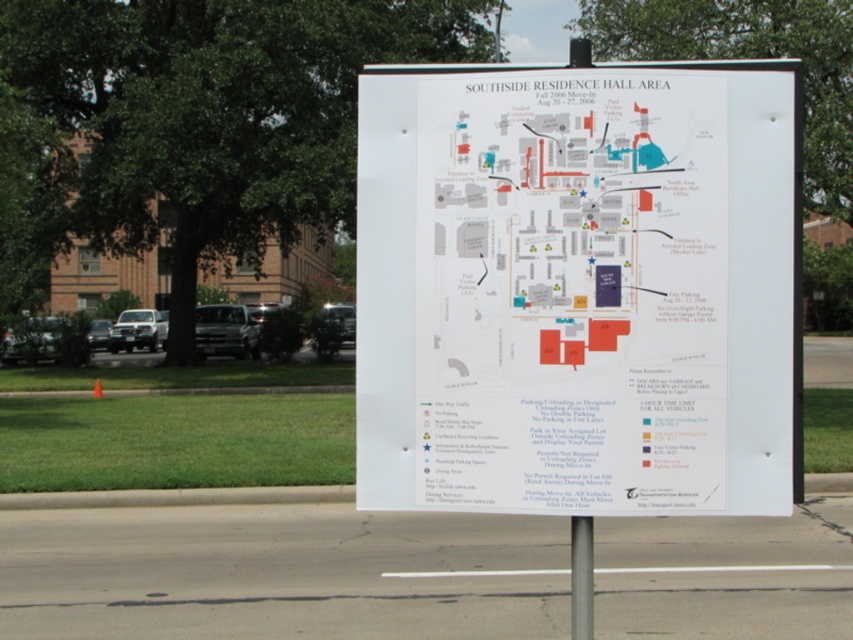
Question: Is white paper map at center further to camera compared to metallic pole at lower center?

Choices:
 (A) yes
 (B) no

Answer: (B)

Question: Which point is farther from the camera taking this photo?

Choices:
 (A) (601, 232)
 (B) (572, 586)

Answer: (B)

Question: From the image, what is the correct spatial relationship of white paper map at center in relation to metallic pole at lower center?

Choices:
 (A) right
 (B) left

Answer: (B)

Question: Is white paper map at center further to camera compared to metallic pole at lower center?

Choices:
 (A) yes
 (B) no

Answer: (B)

Question: Among these points, which one is farthest from the camera?

Choices:
 (A) (575, 556)
 (B) (706, 442)

Answer: (A)